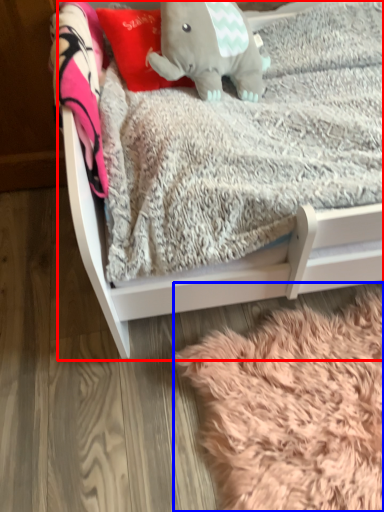
Question: Which point is further to the camera, infant bed (highlighted by a red box) or blanket (highlighted by a blue box)?

Choices:
 (A) infant bed
 (B) blanket

Answer: (B)